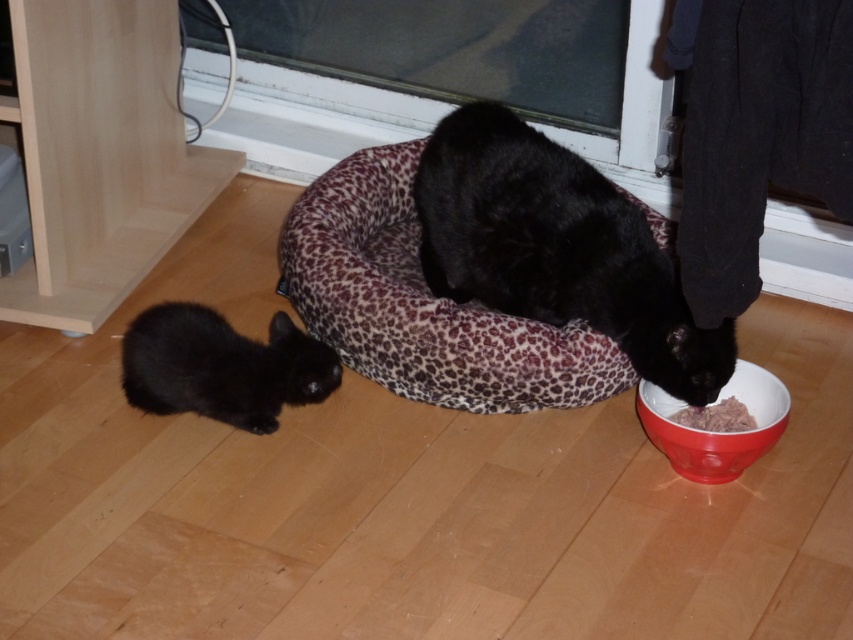
You are a small toy mouse. You are currently on the wooden floor near the edge of the leopard print pet bed. You want to move towards the smooth pinkish food at lower center. However, there is a black fur cat at center in your path. Can you safely reach the food without getting stepped on by the cat?

The black fur cat at center is closer to the viewer than the smooth pinkish food at lower center, so the cat is between you and the food. Therefore, you cannot safely reach the food without passing through the cat, which might result in getting stepped on.

You are a cat owner who wants to place a new toy between the black fur cat at lower left and the red glossy bowl at lower right. Based on their sizes, which object will the toy be closer to?

The black fur cat at lower left is much taller than the red glossy bowl at lower right, so the toy placed between them will be closer to the red glossy bowl at lower right because the cat is taller and occupies more vertical space.

You are a small toy mouse. You want to roll from the black fur cat at lower left to the red glossy bowl at lower right. Can you reach the bowl without going past the cat?

The black fur cat at lower left is further to the viewer than the red glossy bowl at lower right, so the mouse can roll towards the bowl without going past the cat since the bowl is behind the cat.